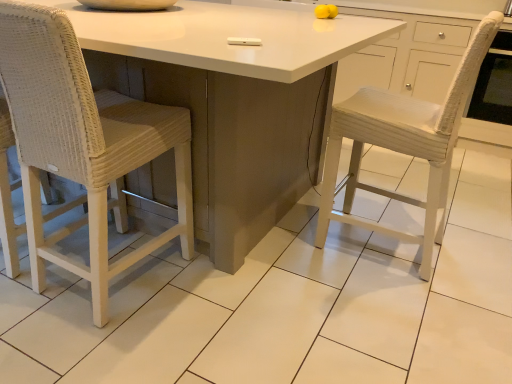
Question: Does point (198, 163) appear closer or farther from the camera than point (129, 100)?

Choices:
 (A) farther
 (B) closer

Answer: (B)

Question: Considering the relative positions of white glossy table at center and woven wicker chair at left in the image provided, is white glossy table at center to the left or to the right of woven wicker chair at left?

Choices:
 (A) left
 (B) right

Answer: (A)

Question: Relative to woven wicker chair at left, is white glossy table at center in front or behind?

Choices:
 (A) front
 (B) behind

Answer: (A)

Question: Does point (70, 74) appear closer or farther from the camera than point (161, 155)?

Choices:
 (A) farther
 (B) closer

Answer: (B)

Question: Looking at the image, does woven wicker chair at left seem bigger or smaller compared to white glossy table at center?

Choices:
 (A) small
 (B) big

Answer: (A)

Question: From a real-world perspective, relative to white glossy table at center, is woven wicker chair at left vertically above or below?

Choices:
 (A) above
 (B) below

Answer: (A)

Question: In terms of height, does woven wicker chair at left look taller or shorter compared to white glossy table at center?

Choices:
 (A) short
 (B) tall

Answer: (B)